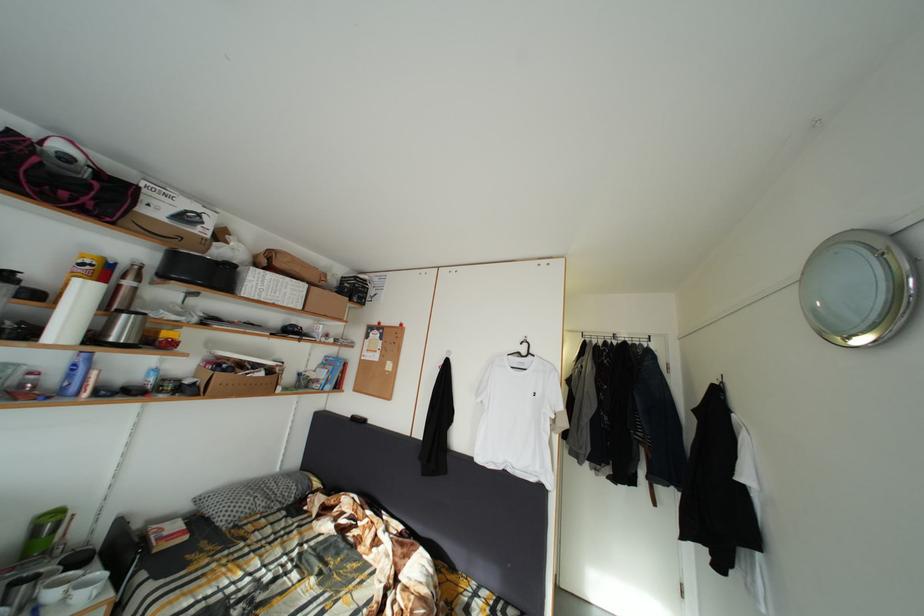
Where is `silver thermos bottle`? Image resolution: width=924 pixels, height=616 pixels. silver thermos bottle is located at coordinates (127, 286).